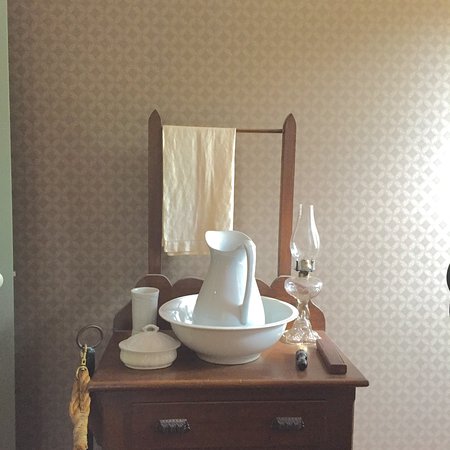
You are a GUI agent. You are given a task and a screenshot of the screen. Output one action in this format:
    pyautogui.click(x=<x>, y=<y>)
    Task: Click on the clear glass kerosene lamp
    This screenshot has height=450, width=450.
    Given the screenshot: What is the action you would take?
    pyautogui.click(x=304, y=286)